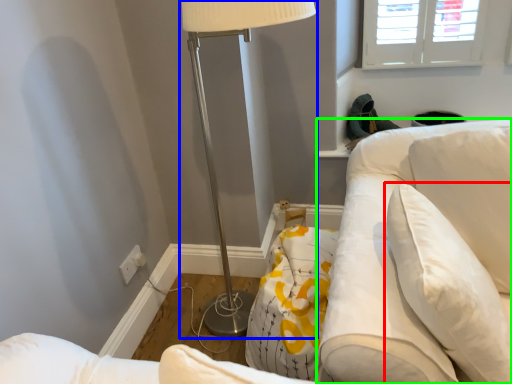
Question: Which object is positioned farthest from pillow (highlighted by a red box)? Select from lamp (highlighted by a blue box) and swivel chair (highlighted by a green box).

Choices:
 (A) lamp
 (B) swivel chair

Answer: (A)